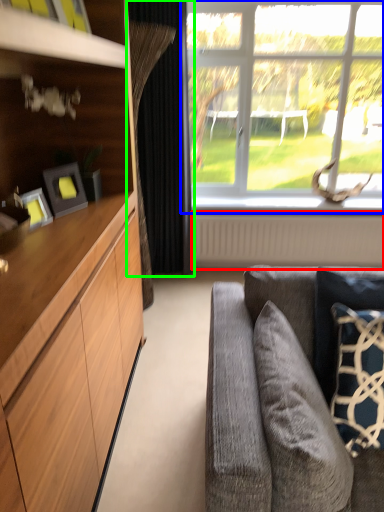
Question: Considering the real-world distances, which object is closest to radiator (highlighted by a red box)? window (highlighted by a blue box) or curtain (highlighted by a green box).

Choices:
 (A) window
 (B) curtain

Answer: (A)